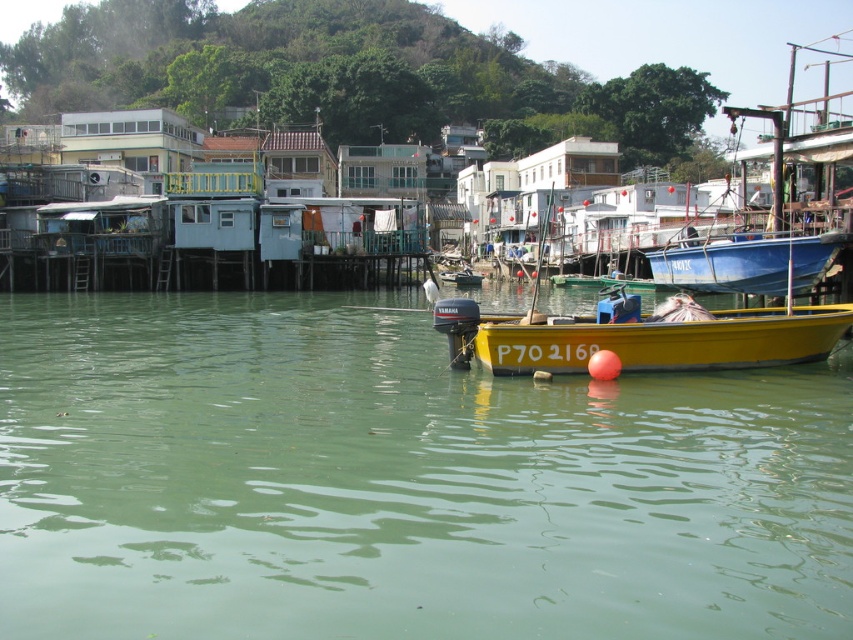
Question: Can you confirm if green water at center is wider than yellow matte boat at center?

Choices:
 (A) no
 (B) yes

Answer: (B)

Question: Which of the following is the closest to the observer?

Choices:
 (A) (451, 316)
 (B) (339, 365)

Answer: (A)

Question: Which of the following is the closest to the observer?

Choices:
 (A) blue matte boat at right
 (B) yellow matte boat at center

Answer: (B)

Question: Where is blue matte boat at right located in relation to yellow matte boat at center in the image?

Choices:
 (A) right
 (B) left

Answer: (A)

Question: Does blue matte boat at right have a smaller size compared to yellow matte boat at center?

Choices:
 (A) no
 (B) yes

Answer: (A)

Question: Which point is farther to the camera?

Choices:
 (A) (730, 625)
 (B) (706, 244)
 (C) (679, 339)

Answer: (B)